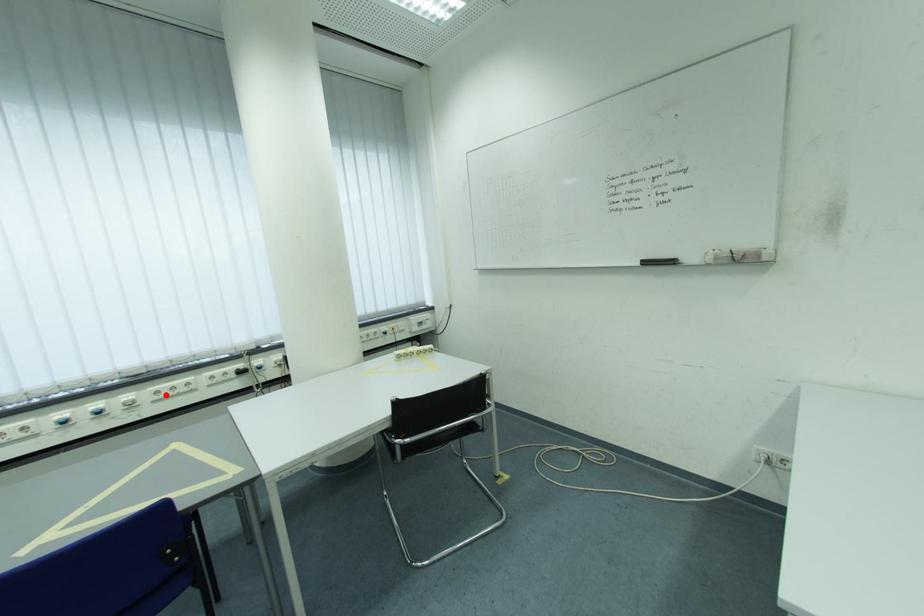
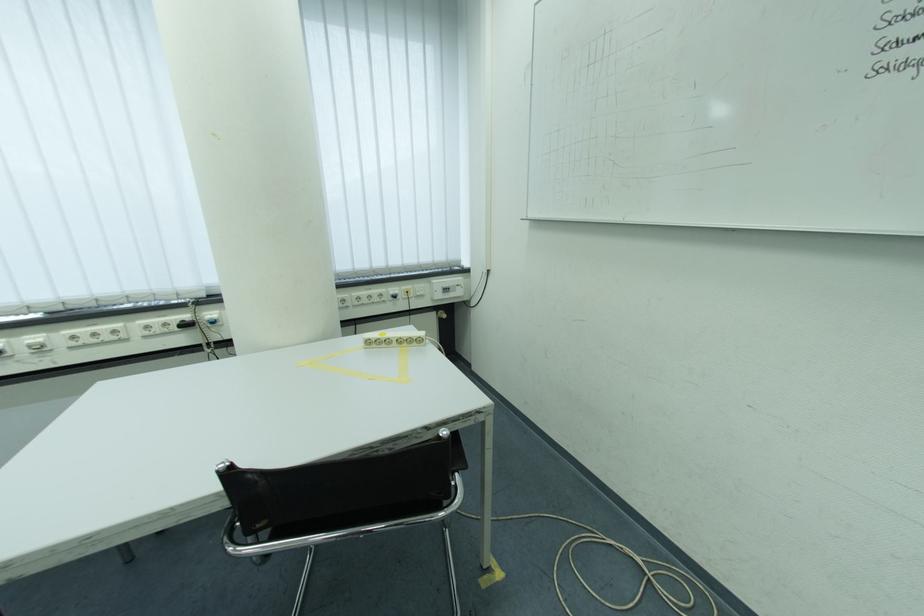
Locate, in the second image, the point that corresponds to the highlighted location in the first image.

(82, 339)